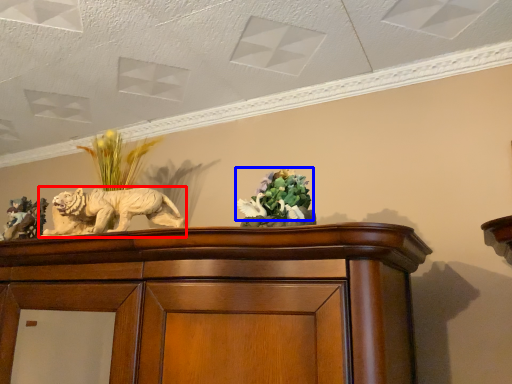
Question: Which point is further to the camera, lion (highlighted by a red box) or flower (highlighted by a blue box)?

Choices:
 (A) lion
 (B) flower

Answer: (A)